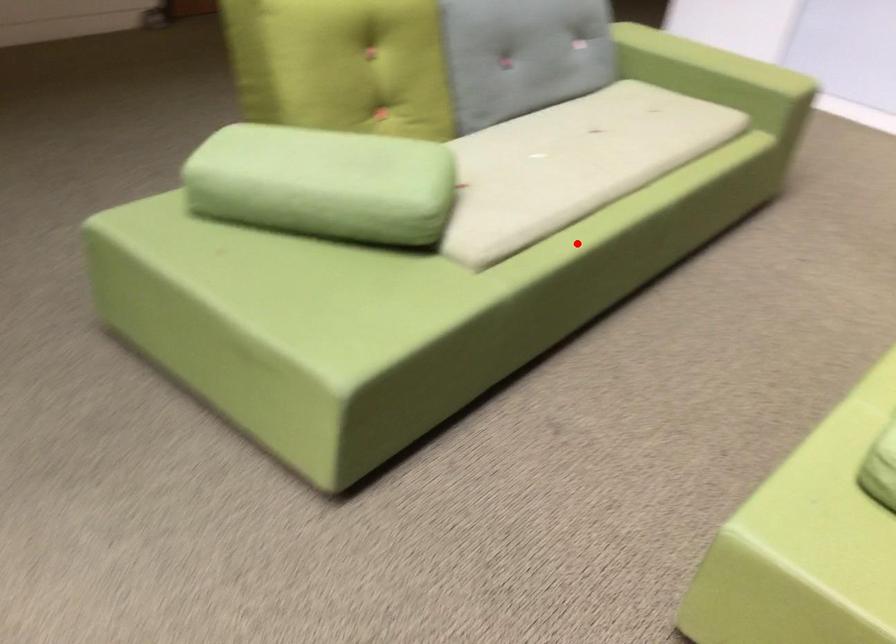
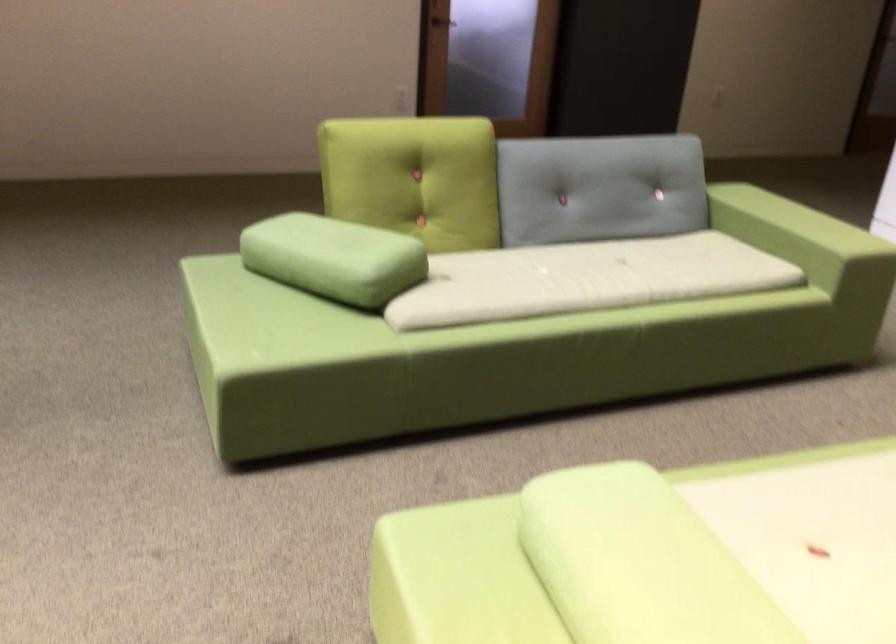
Question: I am providing you with two images of the same scene from different viewpoints. A red point is shown in image1. For the corresponding object point in image2, is it positioned nearer or farther from the camera?

Choices:
 (A) Nearer
 (B) Farther

Answer: (B)